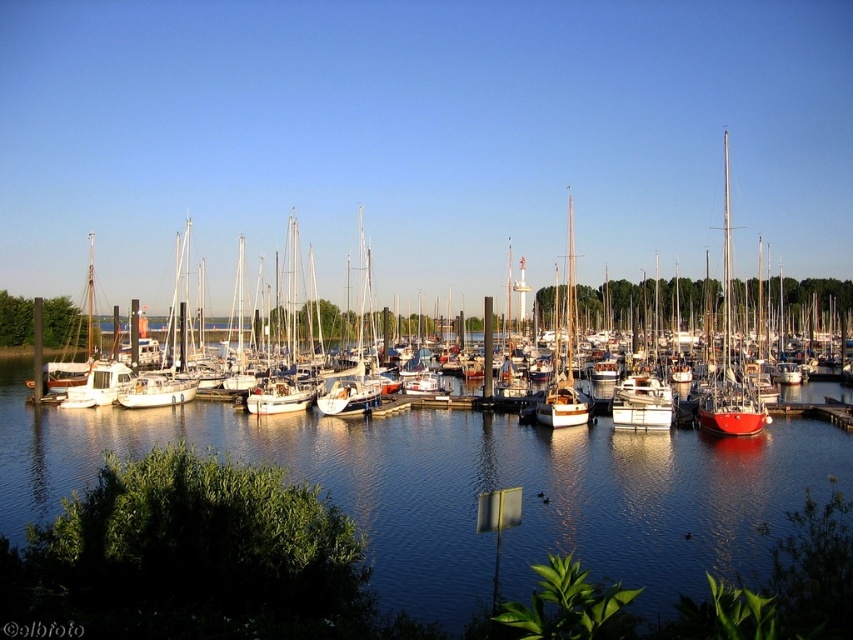
Question: Is clear blue water at center to the left of white matte sailboat at center from the viewer's perspective?

Choices:
 (A) no
 (B) yes

Answer: (A)

Question: Is clear blue water at center positioned behind white matte sailboat at center?

Choices:
 (A) yes
 (B) no

Answer: (B)

Question: Does clear blue water at center have a lesser width compared to white matte sailboat at center?

Choices:
 (A) yes
 (B) no

Answer: (A)

Question: Which object is farther from the camera taking this photo?

Choices:
 (A) clear blue water at center
 (B) white matte sailboat at center

Answer: (B)